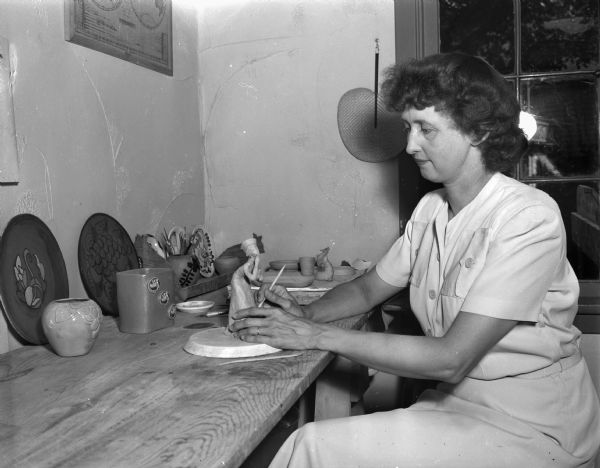
Where is `plate`? plate is located at coordinates (29, 273), (106, 260), (204, 235), (182, 235).